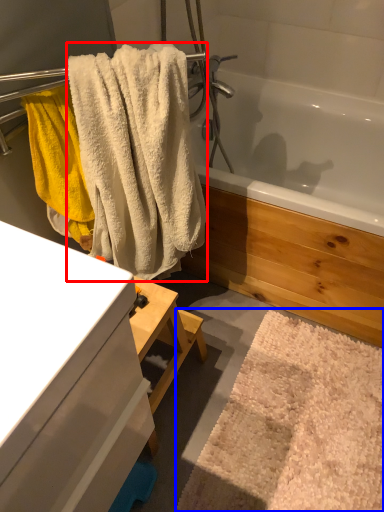
Question: Which of the following is the farthest to the observer, towel (highlighted by a red box) or bath mat (highlighted by a blue box)?

Choices:
 (A) towel
 (B) bath mat

Answer: (B)